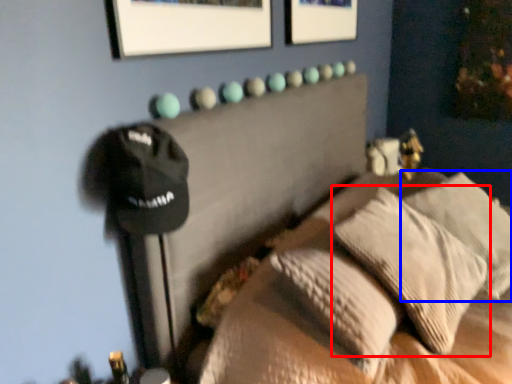
Question: Which of the following is the closest to the observer, pillow (highlighted by a red box) or pillow (highlighted by a blue box)?

Choices:
 (A) pillow
 (B) pillow

Answer: (A)